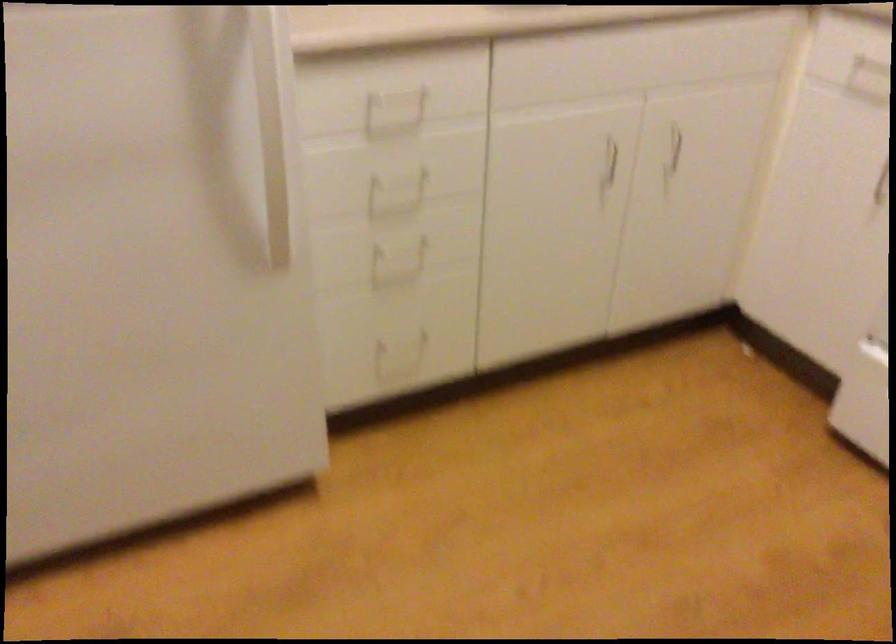
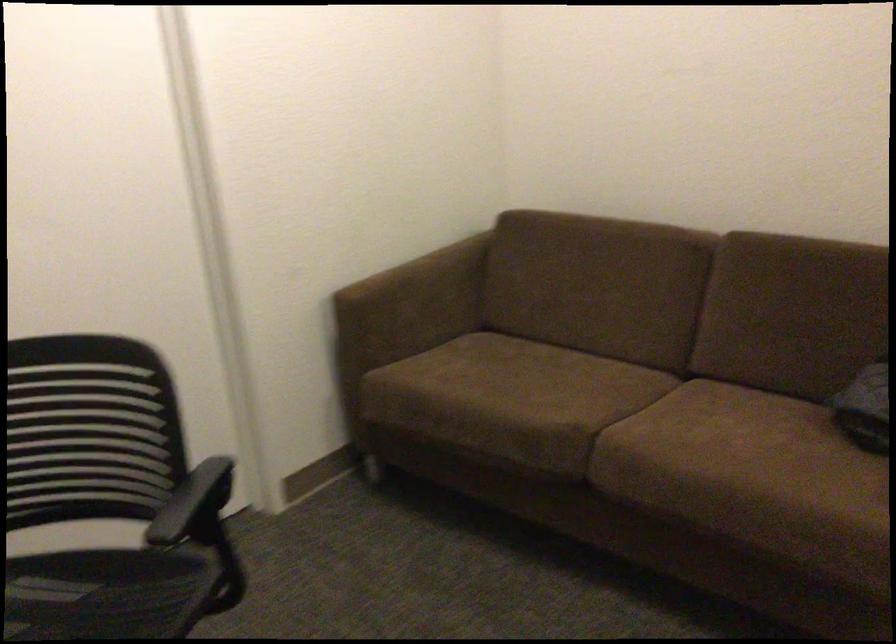
Question: Based on the continuous images, in which direction is the camera rotating? Reply with the corresponding letter.

Choices:
 (A) Left
 (B) Right
 (C) Up
 (D) Down

Answer: (A)